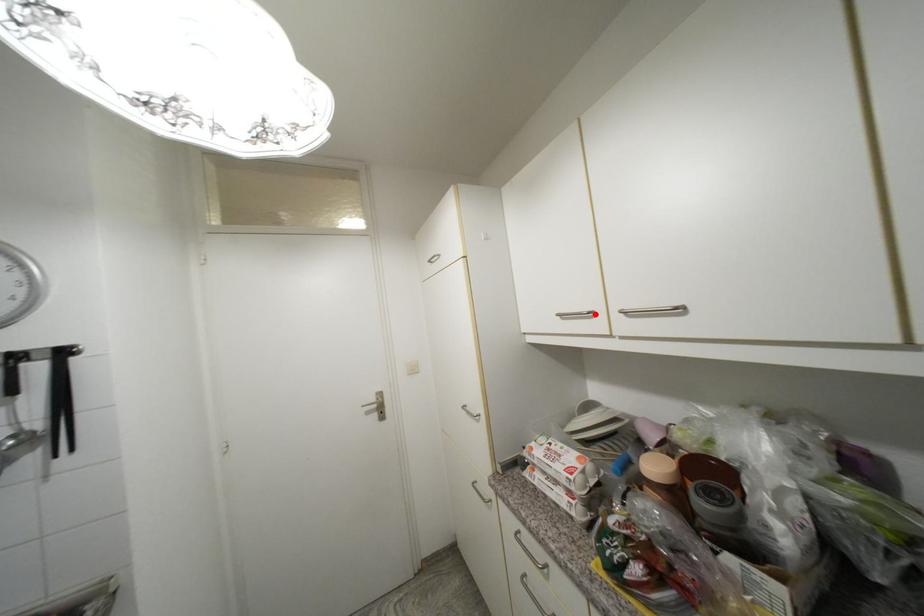
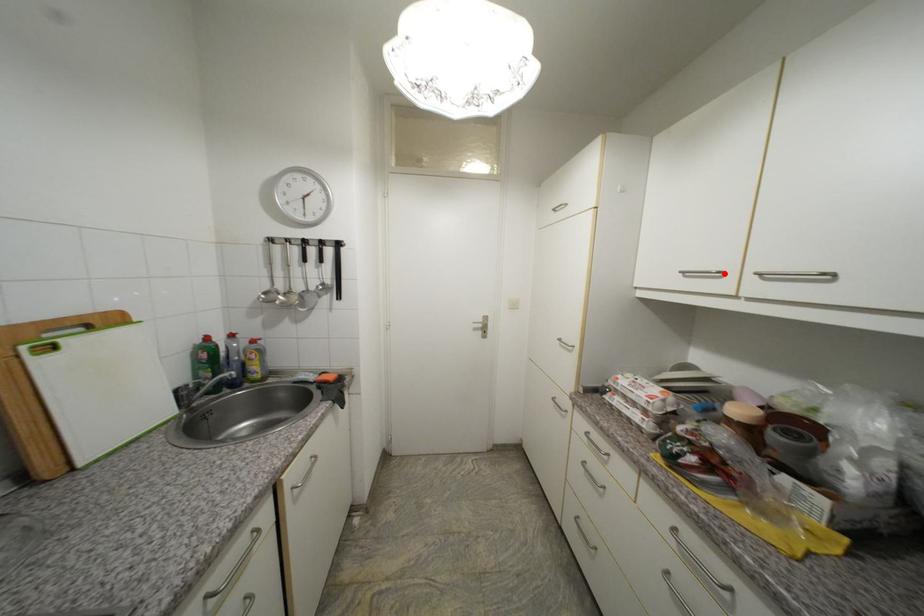
I am providing you with two images of the same scene from different viewpoints. A red point is marked on the first image and another point is marked on the second image. Do the highlighted points in image1 and image2 indicate the same real-world spot?

Yes